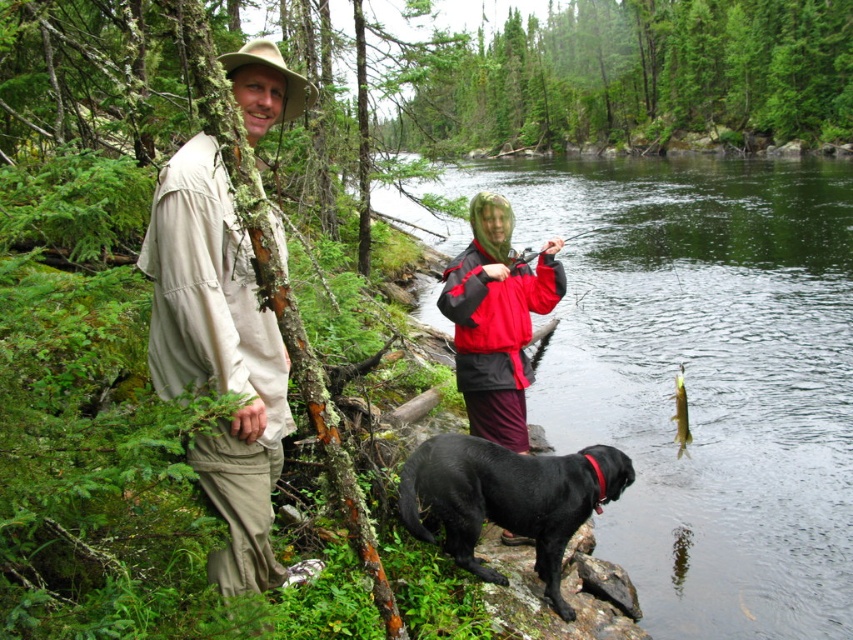
Question: Which object is closer to the camera taking this photo?

Choices:
 (A) shiny gold fish at right
 (B) tan fabric shirt at left
 (C) greenish water at upper center

Answer: (B)

Question: Which object is farther from the camera taking this photo?

Choices:
 (A) greenish water at upper center
 (B) red/black jacket at center
 (C) tan fabric shirt at left

Answer: (A)

Question: Which of the following is the farthest from the observer?

Choices:
 (A) (563, 513)
 (B) (154, 275)
 (C) (827, 566)
 (D) (509, 268)

Answer: (C)

Question: Can you confirm if black matte dog at lower center is positioned to the right of red/black jacket at center?

Choices:
 (A) no
 (B) yes

Answer: (B)

Question: Does greenish water at upper center appear on the right side of black matte dog at lower center?

Choices:
 (A) no
 (B) yes

Answer: (B)

Question: In this image, where is greenish water at upper center located relative to shiny gold fish at right?

Choices:
 (A) below
 (B) above

Answer: (B)